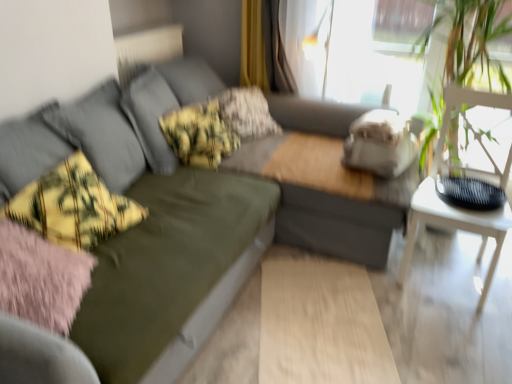
You are a GUI agent. You are given a task and a screenshot of the screen. Output one action in this format:
    pyautogui.click(x=<x>, y=<y>)
    Task: Click on the vacant point to the left of white wooden table at right
    
    Given the screenshot: What is the action you would take?
    pyautogui.click(x=369, y=281)